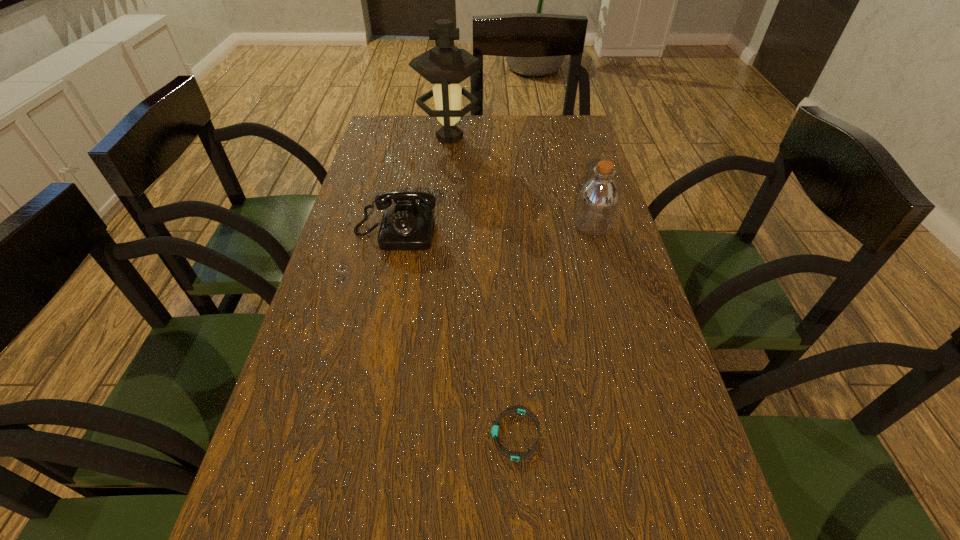
Image resolution: width=960 pixels, height=540 pixels. I want to click on free space between the oil lamp and the third object from left to right, so click(x=483, y=287).

Locate an element on the screen. vacant region between the tallest object and the telephone is located at coordinates (422, 185).

Identify the location of free space between the second tallest object and the second shortest object. The width and height of the screenshot is (960, 540). (493, 230).

The width and height of the screenshot is (960, 540). I want to click on object that stands as the second closest to the third tallest object, so click(x=597, y=202).

Where is `object identified as the second closest to the farthest object`? The width and height of the screenshot is (960, 540). object identified as the second closest to the farthest object is located at coordinates (597, 202).

The image size is (960, 540). In order to click on free point that satisfies the following two spatial constraints: 1. on the front side of the rightmost object; 2. on the buckle of the shortest object in this screenshot , I will do `click(650, 435)`.